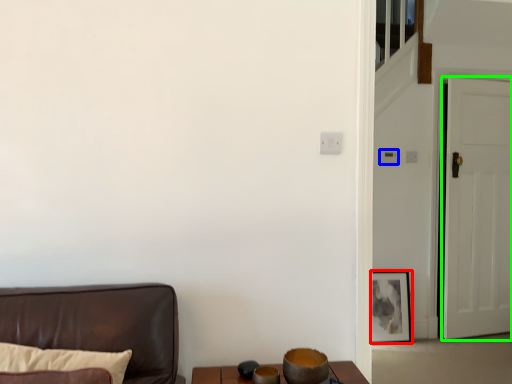
Question: Which is nearer to the picture frame (highlighted by a red box)? light switch (highlighted by a blue box) or door (highlighted by a green box).

Choices:
 (A) light switch
 (B) door

Answer: (B)